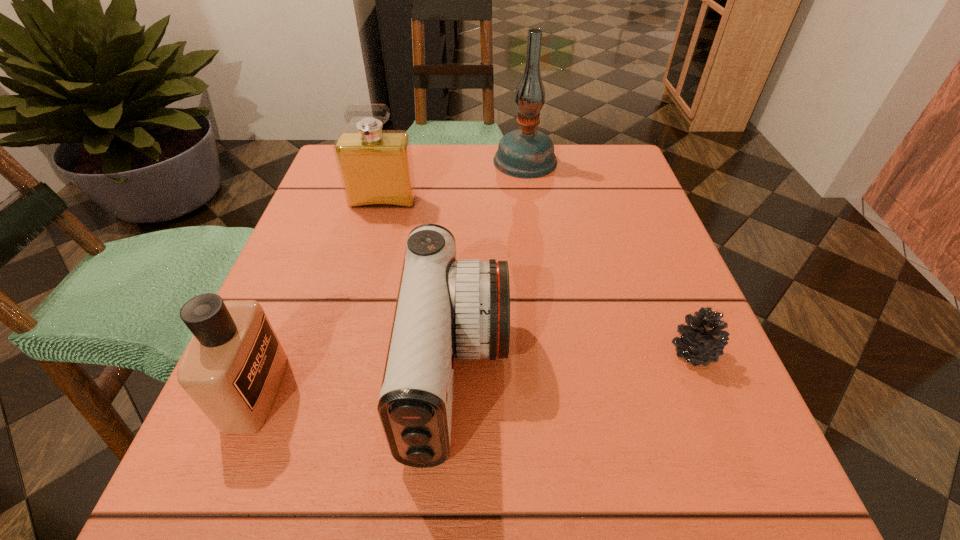
I want to click on vacant space situated 0.350m on the front-facing side of the second farthest object, so (x=345, y=349).

Where is `free space located 0.210m on the surface of the camcorder`? free space located 0.210m on the surface of the camcorder is located at coordinates (652, 374).

Locate an element on the screen. This screenshot has width=960, height=540. vacant space located 0.190m on the front label of the nearer perfume is located at coordinates (415, 391).

Find the location of a particular element. This screenshot has height=540, width=960. vacant region located on the front of the rightmost object is located at coordinates (754, 496).

At what (x,y) coordinates should I click in order to perform the action: click on oil lamp that is positioned at the far edge. Please return your answer as a coordinate pair (x, y). The width and height of the screenshot is (960, 540). Looking at the image, I should click on (526, 153).

I want to click on perfume present at the far edge, so click(x=376, y=168).

Locate an element on the screen. This screenshot has height=540, width=960. object that is at the near edge is located at coordinates (445, 309).

I want to click on object at the right edge, so click(702, 340).

The width and height of the screenshot is (960, 540). I want to click on object situated at the far left corner, so click(x=376, y=168).

This screenshot has width=960, height=540. I want to click on vacant area at the far edge, so click(422, 188).